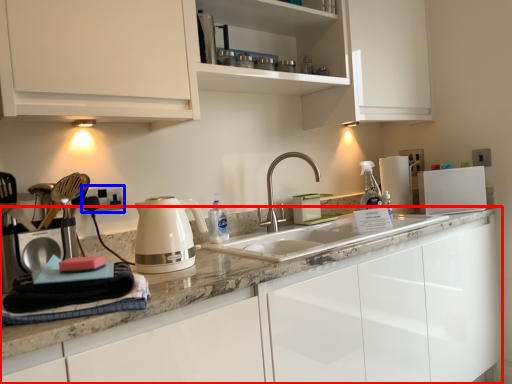
Question: Among these objects, which one is farthest to the camera, cabinetry (highlighted by a red box) or electric outlet (highlighted by a blue box)?

Choices:
 (A) cabinetry
 (B) electric outlet

Answer: (B)